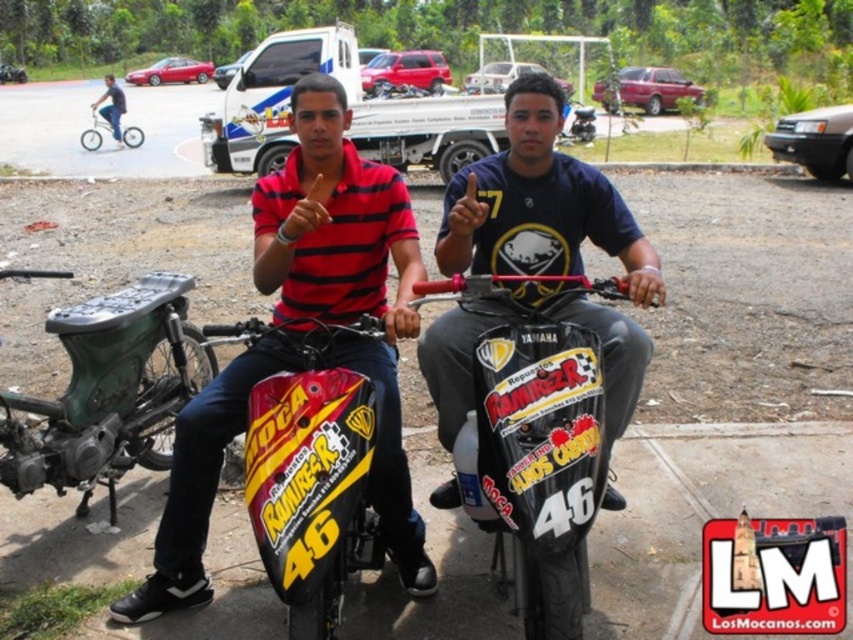
You are a photographer trying to capture a photo of both the black matte motorcycle at center and the shiny red motorcycle at center. Since you want to include both in the frame, which motorcycle should you position your camera closer to in order to ensure both are fully visible?

The black matte motorcycle at center is above the shiny red motorcycle at center, so positioning the camera closer to the shiny red motorcycle at center will help ensure both are fully visible in the frame.

You are standing in the parking lot and need to find the silver metallic bicycle at upper left. Which direction should you look relative to the blue jeans at lower left?

The silver metallic bicycle at upper left is to the right of the blue jeans at lower left, so you should look to the right side of the blue jeans at lower left to find it.

You are a photographer setting up a shoot in this scene. You need to position a light source so it illuminates both the silver metallic bicycle at upper left and the blue jeans at lower left. Based on their positions, which object should the light be placed closer to?

The silver metallic bicycle at upper left is below blue jeans at lower left. Since the blue jeans at lower left is lower, the light should be placed closer to the blue jeans at lower left to ensure both are illuminated properly.